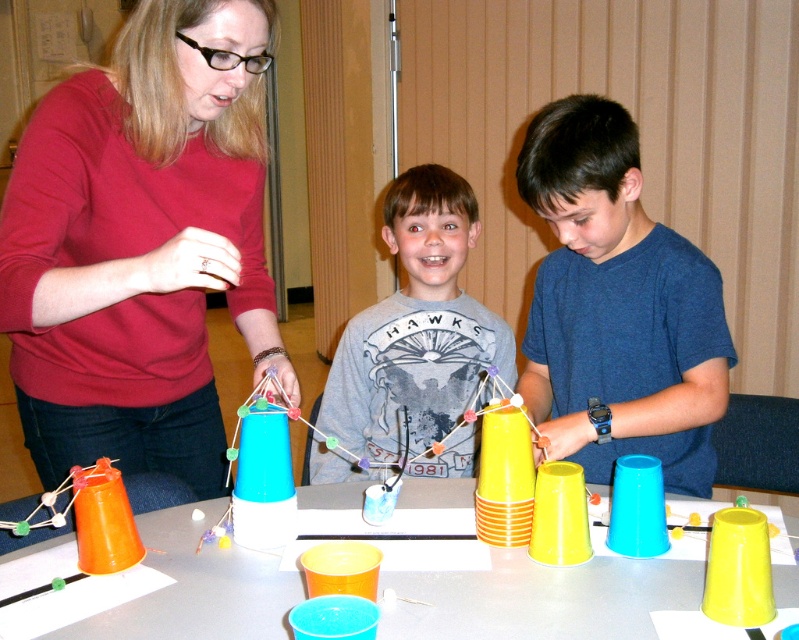
Is smooth plastic cups at center closer to the viewer compared to gray matte shirt at center?

Yes, it is in front of gray matte shirt at center.

Is smooth plastic cups at center shorter than gray matte shirt at center?

Yes, smooth plastic cups at center is shorter than gray matte shirt at center.

Who is more forward, [185,602] or [392,346]?

Point [185,602] is in front.

Locate an element on the screen. smooth plastic cups at center is located at coordinates (543, 596).

Can you confirm if matte red sweater at center is wider than gray matte shirt at center?

Yes, matte red sweater at center is wider than gray matte shirt at center.

Who is taller, matte red sweater at center or gray matte shirt at center?

matte red sweater at center is taller.

Locate an element on the screen. matte red sweater at center is located at coordinates (138, 257).

Can you confirm if blue matte cup at center is positioned to the left of gray matte shirt at center?

In fact, blue matte cup at center is to the right of gray matte shirt at center.

Does blue matte cup at center have a greater height compared to gray matte shirt at center?

Incorrect, blue matte cup at center's height is not larger of gray matte shirt at center's.

Measure the distance between blue matte cup at center and camera.

blue matte cup at center and camera are 4.12 feet apart.

Where is `blue matte cup at center`? This screenshot has height=640, width=799. blue matte cup at center is located at coordinates (617, 307).